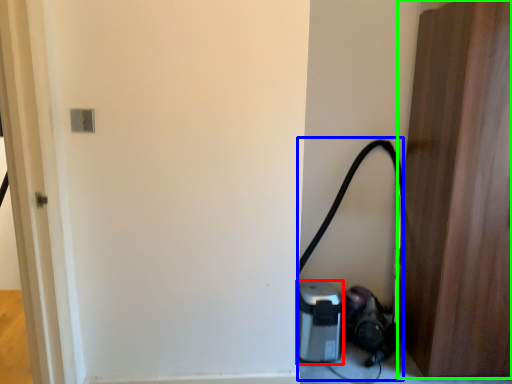
Question: Which object is the closest to the appliance (highlighted by a red box)? Choose among these: garden hose (highlighted by a blue box) or door (highlighted by a green box).

Choices:
 (A) garden hose
 (B) door

Answer: (A)